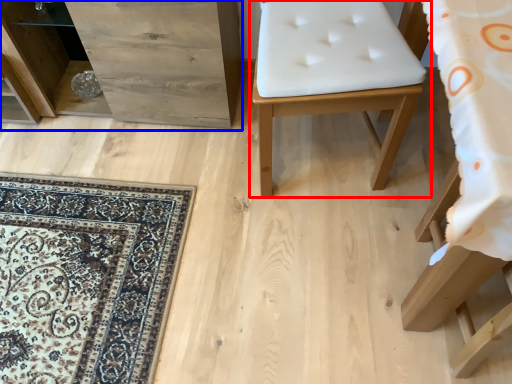
Question: Among these objects, which one is nearest to the camera, furniture (highlighted by a red box) or dresser (highlighted by a blue box)?

Choices:
 (A) furniture
 (B) dresser

Answer: (A)